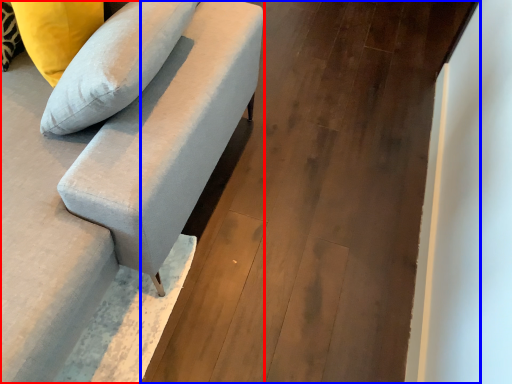
Question: Among these objects, which one is nearest to the camera, studio couch (highlighted by a red box) or concrete (highlighted by a blue box)?

Choices:
 (A) studio couch
 (B) concrete

Answer: (A)